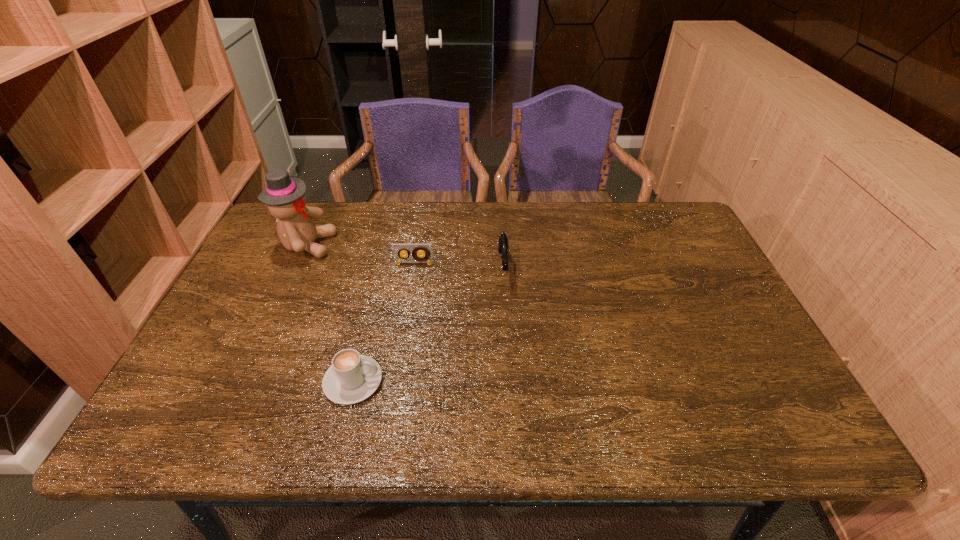
Where is `vacant area that lies between the leftmost object and the videotape`? The height and width of the screenshot is (540, 960). vacant area that lies between the leftmost object and the videotape is located at coordinates (360, 254).

Where is `vacant space that's between the nearest object and the rightmost object`? The height and width of the screenshot is (540, 960). vacant space that's between the nearest object and the rightmost object is located at coordinates (428, 325).

Identify the location of free space that is in between the tallest object and the cappuccino. This screenshot has width=960, height=540. (330, 313).

Locate an element on the screen. The image size is (960, 540). unoccupied position between the tallest object and the videotape is located at coordinates (360, 254).

You are a GUI agent. You are given a task and a screenshot of the screen. Output one action in this format:
    pyautogui.click(x=<x>, y=<y>)
    Task: Click on the vacant point located between the gun and the cappuccino
    The height and width of the screenshot is (540, 960).
    Given the screenshot: What is the action you would take?
    pyautogui.click(x=428, y=325)

Where is `empty space between the videotape and the nearest object`? empty space between the videotape and the nearest object is located at coordinates (383, 322).

At what (x,y) coordinates should I click in order to perform the action: click on free space between the cappuccino and the second tallest object. Please return your answer as a coordinate pair (x, y). The width and height of the screenshot is (960, 540). Looking at the image, I should click on (428, 325).

Identify the location of object that is the second closest to the videotape. The width and height of the screenshot is (960, 540). (285, 196).

The image size is (960, 540). Find the location of `the closest object relative to the videotape`. the closest object relative to the videotape is located at coordinates (503, 240).

Locate an element on the screen. The height and width of the screenshot is (540, 960). free space that satisfies the following two spatial constraints: 1. at the end of the barrel of the gun; 2. to the right of the cappuccino is located at coordinates 510,381.